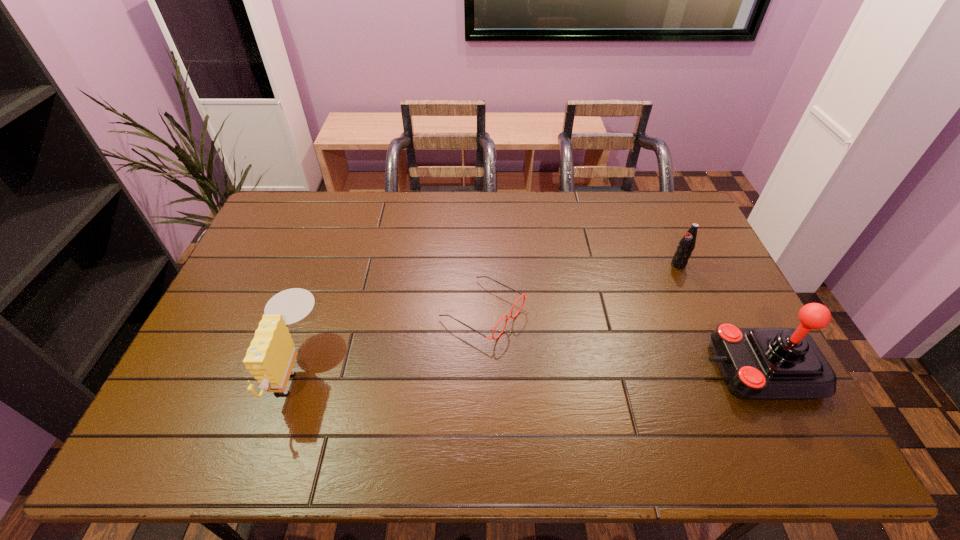
Find the location of a particular element. Image resolution: width=960 pixels, height=540 pixels. vacant spot on the desktop that is between the second tallest object and the joystick and is positioned on the front-facing side of the second object from left to right is located at coordinates (588, 369).

At what (x,y) coordinates should I click in order to perform the action: click on free space on the desktop that is between the leftmost object and the tallest object and is positioned on the front label of the pop. Please return your answer as a coordinate pair (x, y). Looking at the image, I should click on (494, 369).